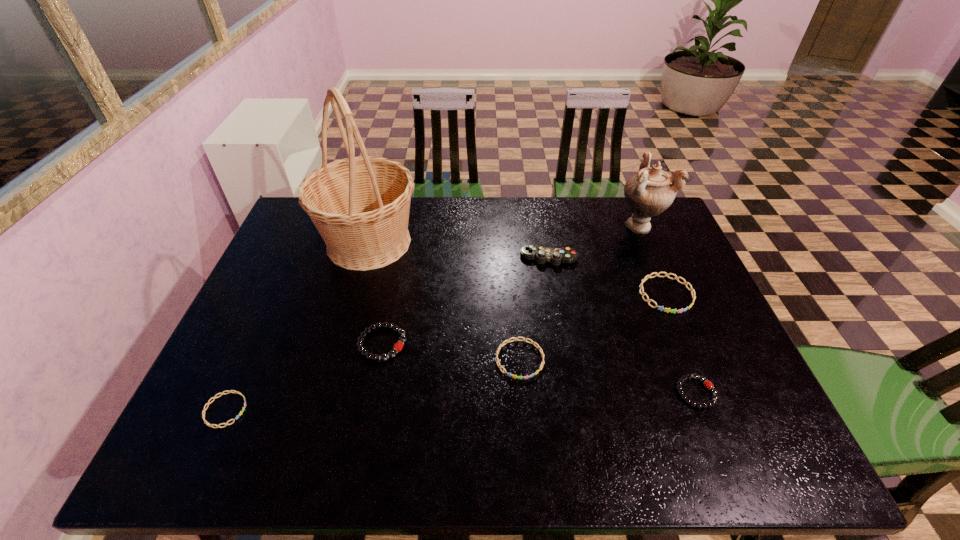
The width and height of the screenshot is (960, 540). What are the coordinates of `the smaller black bracelet` in the screenshot? It's located at [707, 384].

Where is `the leftmost object`? Image resolution: width=960 pixels, height=540 pixels. the leftmost object is located at coordinates (243, 408).

The width and height of the screenshot is (960, 540). Find the location of `the nearest blue bracelet`. the nearest blue bracelet is located at coordinates (243, 408).

The image size is (960, 540). Find the location of `blank area located on the back of the tallest object`. blank area located on the back of the tallest object is located at coordinates (380, 204).

Where is `vacant space situated on the left of the urn`? vacant space situated on the left of the urn is located at coordinates (524, 225).

Where is `vacant space located on the left of the sixth shortest object`? vacant space located on the left of the sixth shortest object is located at coordinates (481, 257).

Locate an element on the screen. The height and width of the screenshot is (540, 960). free space located 0.150m on the surface of the farthest bracelet showing star-shaped elements is located at coordinates (694, 361).

This screenshot has height=540, width=960. I want to click on blank space located on the back of the farther black bracelet, so click(x=390, y=306).

What are the coordinates of `free region located on the surface of the second smallest blue bracelet showing star-shaped elements` in the screenshot? It's located at (525, 433).

The height and width of the screenshot is (540, 960). Identify the location of free space located on the front of the nearer black bracelet. (711, 432).